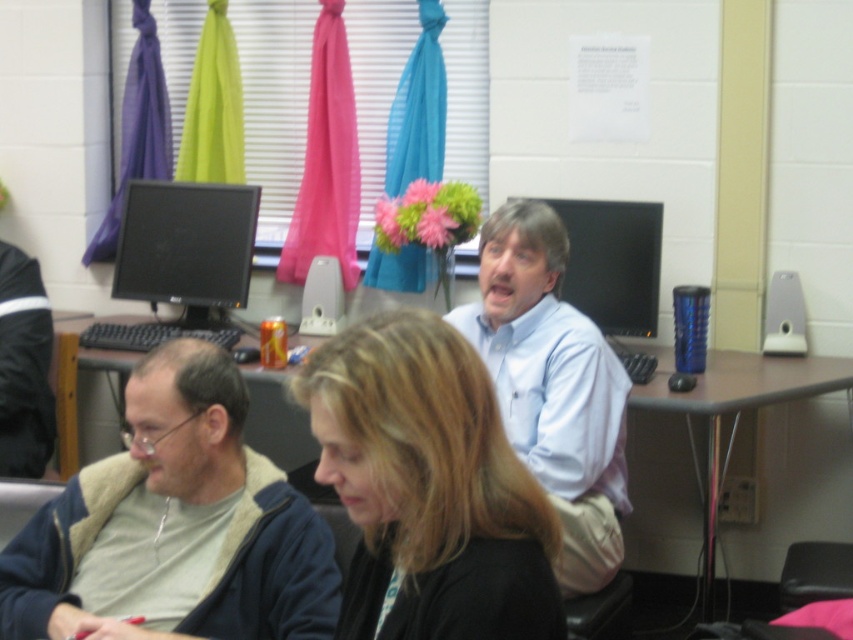
You are organizing a presentation and need to know which object has a smaller width between the black glossy monitor at upper left and the brown wood table at center. Which one is narrower?

The black glossy monitor at upper left is narrower than the brown wood table at center.

You need to place a rectangular box that is 1.2 meters wide on the desk. The blue fleece jacket at lower left and the matte black monitor at center are already on the desk. Can both items fit side by side with the box without overlapping?

The blue fleece jacket at lower left is wider than the matte black monitor at center. However, the combined width of both items would exceed the box width of 1.2 meters, so they cannot fit side by side with the box without overlapping.